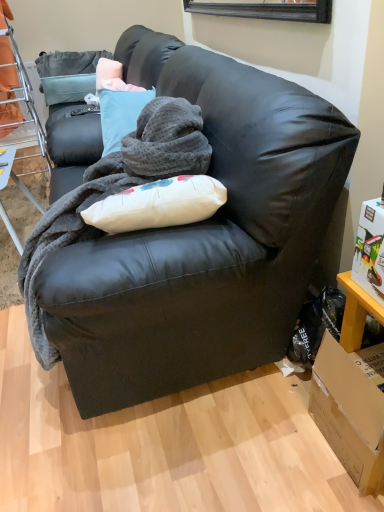
You are a GUI agent. You are given a task and a screenshot of the screen. Output one action in this format:
    pyautogui.click(x=<x>, y=<y>)
    Task: Click on the metal mesh table at lower left
    This screenshot has height=512, width=384.
    Given the screenshot: What is the action you would take?
    pyautogui.click(x=13, y=174)

Where is `orange fabric bunk bed at left`? The width and height of the screenshot is (384, 512). orange fabric bunk bed at left is located at coordinates pos(19,101).

You are a GUI agent. You are given a task and a screenshot of the screen. Output one action in this format:
    pyautogui.click(x=<x>, y=<y>)
    Task: Click on the brown cardboard box at lower right
    Image resolution: width=384 pixels, height=512 pixels.
    Given the screenshot: What is the action you would take?
    pyautogui.click(x=349, y=415)

The height and width of the screenshot is (512, 384). Find the location of `metal mesh table at lower left`. metal mesh table at lower left is located at coordinates (13, 174).

Between brown cardboard box at lower right and soft gray fleece blanket at center, which one has more height?

Standing taller between the two is soft gray fleece blanket at center.

Does brown cardboard box at lower right have a smaller size compared to soft gray fleece blanket at center?

Correct, brown cardboard box at lower right occupies less space than soft gray fleece blanket at center.

Is brown cardboard box at lower right to the right of soft gray fleece blanket at center from the viewer's perspective?

Yes, brown cardboard box at lower right is to the right of soft gray fleece blanket at center.

Is metal mesh table at lower left in contact with brown cardboard box at lower right?

No, metal mesh table at lower left is not making contact with brown cardboard box at lower right.

Which of these two, metal mesh table at lower left or brown cardboard box at lower right, stands taller?

metal mesh table at lower left.

Which of these two, metal mesh table at lower left or brown cardboard box at lower right, is thinner?

With smaller width is metal mesh table at lower left.

Consider the image. Which object is positioned more to the right, metal mesh table at lower left or brown cardboard box at lower right?

brown cardboard box at lower right is more to the right.

Considering the relative sizes of brown cardboard box at lower right and matte black couch at center in the image provided, is brown cardboard box at lower right wider than matte black couch at center?

No, brown cardboard box at lower right is not wider than matte black couch at center.

Are brown cardboard box at lower right and matte black couch at center located far from each other?

That's not correct — brown cardboard box at lower right is a little close to matte black couch at center.

Between brown cardboard box at lower right and matte black couch at center, which one has smaller size?

Smaller between the two is brown cardboard box at lower right.

At what (x,y) coordinates should I click in order to perform the action: click on box below the matte black couch at center (from the image's perspective). Please return your answer as a coordinate pair (x, y). Looking at the image, I should click on (349, 415).

In the scene shown: Is orange fabric bunk bed at left oriented away from brown cardboard box at lower right?

That's not correct — orange fabric bunk bed at left is not looking away from brown cardboard box at lower right.

From a real-world perspective, who is located lower, orange fabric bunk bed at left or brown cardboard box at lower right?

From a 3D spatial view, brown cardboard box at lower right is below.

From the image's perspective, relative to brown cardboard box at lower right, is orange fabric bunk bed at left above or below?

From the image's perspective, orange fabric bunk bed at left appears above brown cardboard box at lower right.

Considering their positions, is orange fabric bunk bed at left located in front of or behind brown cardboard box at lower right?

Visually, orange fabric bunk bed at left is located behind brown cardboard box at lower right.

In terms of height, does orange fabric bunk bed at left look taller or shorter compared to soft gray fleece blanket at center?

Clearly, orange fabric bunk bed at left is taller compared to soft gray fleece blanket at center.

Considering the relative positions of orange fabric bunk bed at left and soft gray fleece blanket at center in the image provided, is orange fabric bunk bed at left behind soft gray fleece blanket at center?

Yes, orange fabric bunk bed at left is behind soft gray fleece blanket at center.

Find the location of a particular element. The height and width of the screenshot is (512, 384). bunk bed that appears behind the soft gray fleece blanket at center is located at coordinates (19, 101).

Is orange fabric bunk bed at left inside the boundaries of soft gray fleece blanket at center, or outside?

orange fabric bunk bed at left is located beyond the bounds of soft gray fleece blanket at center.

From a real-world perspective, is orange fabric bunk bed at left physically above metal mesh table at lower left?

Yes, from a real-world perspective, orange fabric bunk bed at left is over metal mesh table at lower left

What's the angular difference between orange fabric bunk bed at left and metal mesh table at lower left's facing directions?

1.38 degrees separate the facing orientations of orange fabric bunk bed at left and metal mesh table at lower left.

From the picture: Considering the relative sizes of orange fabric bunk bed at left and metal mesh table at lower left in the image provided, is orange fabric bunk bed at left shorter than metal mesh table at lower left?

In fact, orange fabric bunk bed at left may be taller than metal mesh table at lower left.

From the image's perspective, is orange fabric bunk bed at left over metal mesh table at lower left?

Yes, from the image's perspective, orange fabric bunk bed at left is on top of metal mesh table at lower left.

Is matte black couch at center bigger or smaller than orange fabric bunk bed at left?

Clearly, matte black couch at center is larger in size than orange fabric bunk bed at left.

Which is farther, (275,212) or (18,121)?

The point (18,121) is behind.

Does matte black couch at center have a greater width compared to orange fabric bunk bed at left?

Indeed, matte black couch at center has a greater width compared to orange fabric bunk bed at left.

Is the position of matte black couch at center less distant than that of orange fabric bunk bed at left?

Yes, it is in front of orange fabric bunk bed at left.

The width and height of the screenshot is (384, 512). In order to click on box below the soft gray fleece blanket at center (from a real-world perspective) in this screenshot , I will do `click(349, 415)`.

I want to click on table lying on the left of brown cardboard box at lower right, so click(x=13, y=174).

Estimate the real-world distances between objects in this image. Which object is further from matte black couch at center, brown cardboard box at lower right or orange fabric bunk bed at left?

Based on the image, orange fabric bunk bed at left appears to be further to matte black couch at center.

Looking at the image, which one is located further to soft gray fleece blanket at center, orange fabric bunk bed at left or brown cardboard box at lower right?

orange fabric bunk bed at left lies further to soft gray fleece blanket at center than the other object.

Based on their spatial positions, is brown cardboard box at lower right or metal mesh table at lower left further from soft gray fleece blanket at center?

metal mesh table at lower left lies further to soft gray fleece blanket at center than the other object.

When comparing their distances from orange fabric bunk bed at left, does metal mesh table at lower left or matte black couch at center seem closer?

metal mesh table at lower left.

Estimate the real-world distances between objects in this image. Which object is closer to brown cardboard box at lower right, metal mesh table at lower left or matte black couch at center?

matte black couch at center is positioned closer to the anchor brown cardboard box at lower right.

When comparing their distances from metal mesh table at lower left, does soft gray fleece blanket at center or matte black couch at center seem closer?

soft gray fleece blanket at center is closer to metal mesh table at lower left.

From the image, which object appears to be nearer to orange fabric bunk bed at left, soft gray fleece blanket at center or matte black couch at center?

soft gray fleece blanket at center lies closer to orange fabric bunk bed at left than the other object.

Based on their spatial positions, is metal mesh table at lower left or brown cardboard box at lower right closer to orange fabric bunk bed at left?

The object closer to orange fabric bunk bed at left is metal mesh table at lower left.

The width and height of the screenshot is (384, 512). I want to click on blanket between metal mesh table at lower left and brown cardboard box at lower right in the horizontal direction, so click(114, 192).

You are a GUI agent. You are given a task and a screenshot of the screen. Output one action in this format:
    pyautogui.click(x=<x>, y=<y>)
    Task: Click on the table positioned between matte black couch at center and orange fabric bunk bed at left from near to far
    The image size is (384, 512).
    Given the screenshot: What is the action you would take?
    pyautogui.click(x=13, y=174)

Where is `table located between soft gray fleece blanket at center and orange fabric bunk bed at left in the depth direction`? table located between soft gray fleece blanket at center and orange fabric bunk bed at left in the depth direction is located at coordinates (13, 174).

The image size is (384, 512). Find the location of `blanket positioned between matte black couch at center and orange fabric bunk bed at left from near to far`. blanket positioned between matte black couch at center and orange fabric bunk bed at left from near to far is located at coordinates (114, 192).